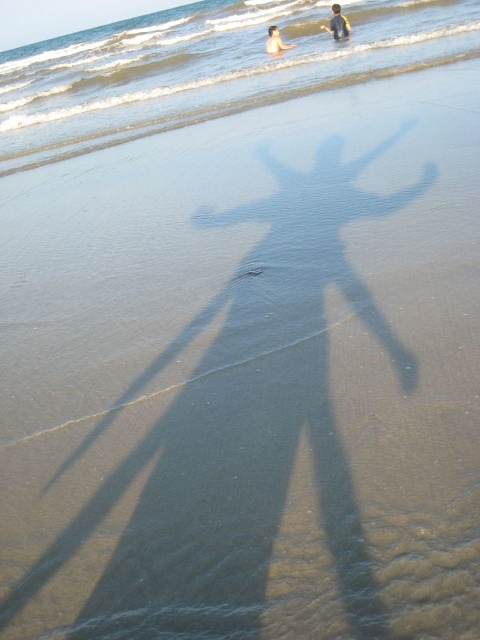
Is clear water at center below yellow fabric shirt at upper center?

No, clear water at center is not below yellow fabric shirt at upper center.

Is clear water at center in front of yellow fabric shirt at upper center?

Yes.

The height and width of the screenshot is (640, 480). I want to click on clear water at center, so click(x=207, y=67).

Is point (331, 32) closer to viewer compared to point (276, 29)?

No, (331, 32) is behind (276, 29).

Where is `yellow fabric shirt at upper center`? This screenshot has width=480, height=640. yellow fabric shirt at upper center is located at coordinates (337, 24).

Is point (331, 33) positioned before point (274, 54)?

No, it is not.

Locate an element on the screen. The width and height of the screenshot is (480, 640). yellow fabric shirt at upper center is located at coordinates (337, 24).

Describe the element at coordinates (207, 67) in the screenshot. I see `clear water at center` at that location.

Is clear water at center to the left of smooth skin person at upper center from the viewer's perspective?

Yes, clear water at center is to the left of smooth skin person at upper center.

Is point (434, 60) less distant than point (276, 44)?

Yes, it is in front of point (276, 44).

Find the location of a particular element. clear water at center is located at coordinates (207, 67).